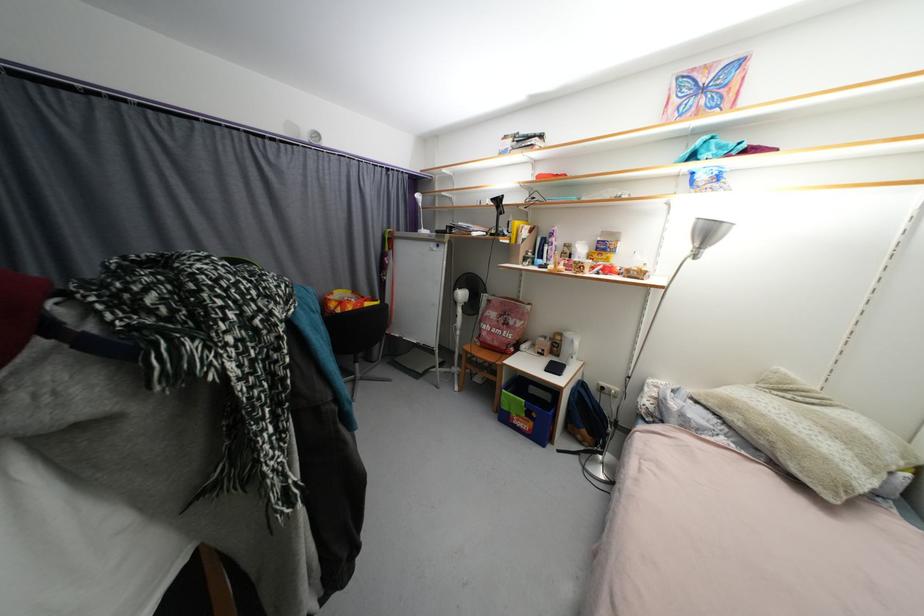
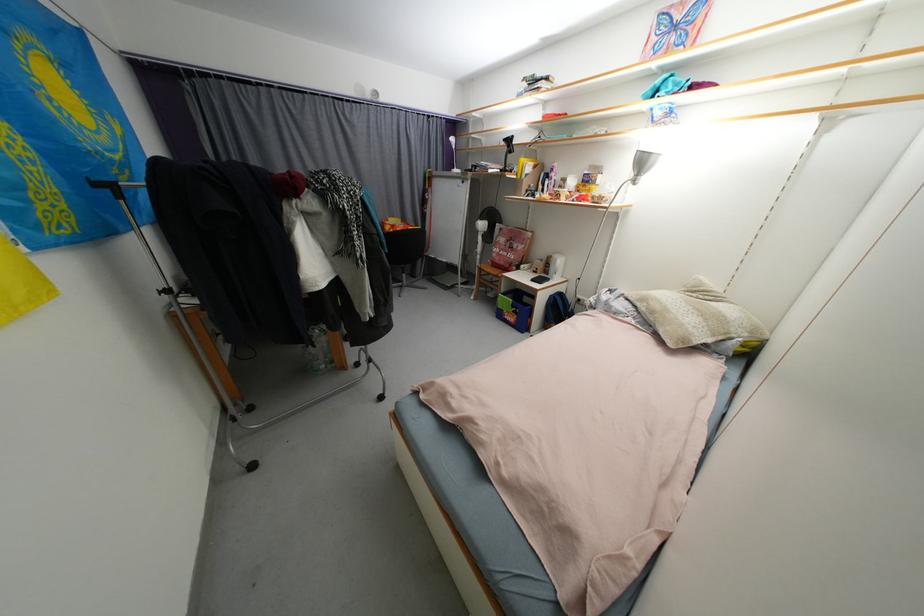
Find the pixel in the second image that matches pixel 565 336 in the first image.

(557, 257)